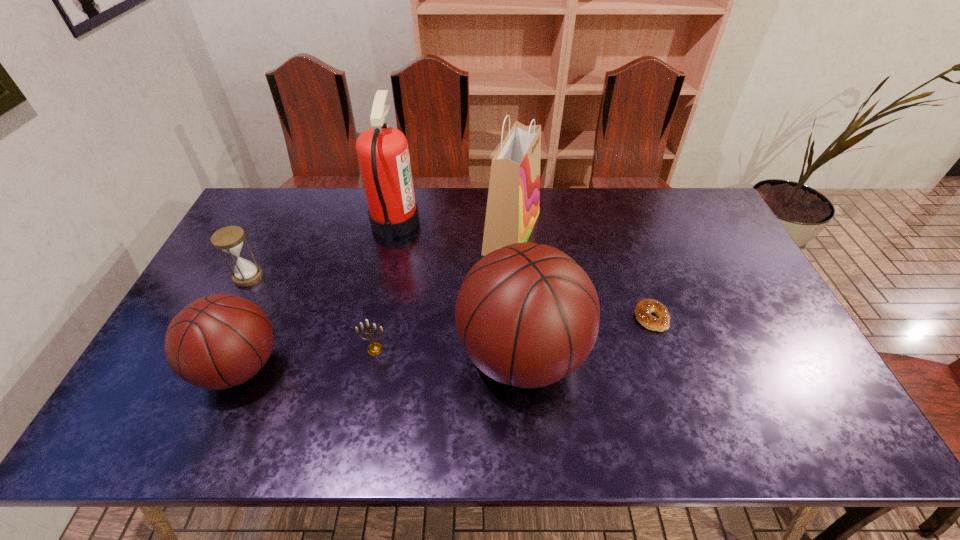
You are a GUI agent. You are given a task and a screenshot of the screen. Output one action in this format:
    pyautogui.click(x=<x>, y=<y>)
    Task: Click on the rightmost object
    
    Given the screenshot: What is the action you would take?
    pyautogui.click(x=644, y=308)

At what (x,y) coordinates should I click in order to perform the action: click on vacant space located on the right of the shorter basketball. Please return your answer as a coordinate pair (x, y). This screenshot has height=540, width=960. Looking at the image, I should click on (378, 367).

Locate an element on the screen. Image resolution: width=960 pixels, height=540 pixels. vacant space located on the back of the taller basketball is located at coordinates (513, 233).

I want to click on free point located 0.200m at the nozzle of the fire extinguisher, so click(477, 222).

At what (x,y) coordinates should I click in order to perform the action: click on free point located 0.260m on the front of the shopping bag. Please return your answer as a coordinate pair (x, y). The image size is (960, 540). Looking at the image, I should click on (519, 330).

Where is `free region located on the right of the hourglass`? The height and width of the screenshot is (540, 960). free region located on the right of the hourglass is located at coordinates (332, 276).

Where is `vacant space situated 0.090m on the right of the sixth tallest object`? vacant space situated 0.090m on the right of the sixth tallest object is located at coordinates coord(423,349).

This screenshot has height=540, width=960. I want to click on vacant region located 0.370m on the back of the shortest object, so click(x=618, y=221).

This screenshot has width=960, height=540. Identify the location of fire extinguisher at the far edge. (383, 153).

In order to click on shopping bag located at the far edge in this screenshot , I will do `click(513, 203)`.